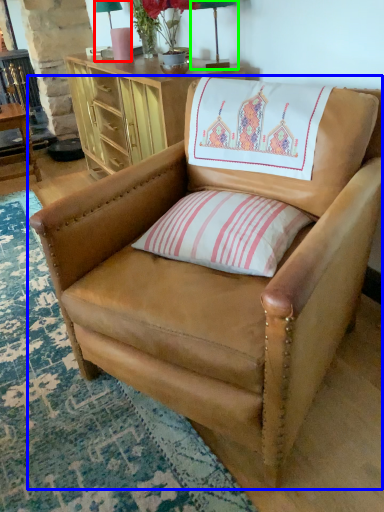
Question: Which object is the farthest from table lamp (highlighted by a red box)? Choose among these: chair (highlighted by a blue box) or table lamp (highlighted by a green box).

Choices:
 (A) chair
 (B) table lamp

Answer: (A)